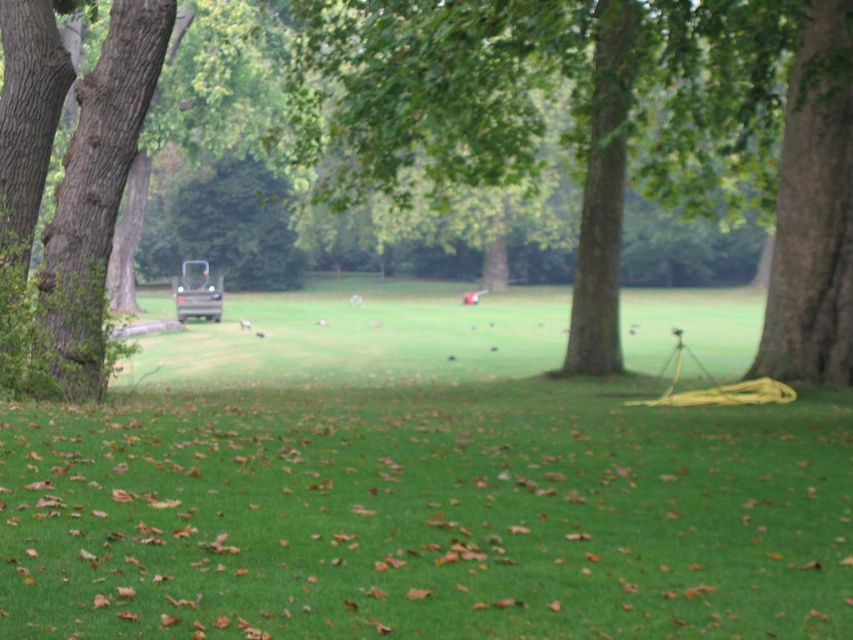
You are planning to set up a picnic blanket in the park. You want to ensure there is enough space between the green grass at center and the brown rough tree at center for a 2 meter wide picnic blanket. Can you fit it there?

The green grass at center has a larger width than the brown rough tree at center, so the space between them is sufficient to accommodate a 2 meter wide picnic blanket.